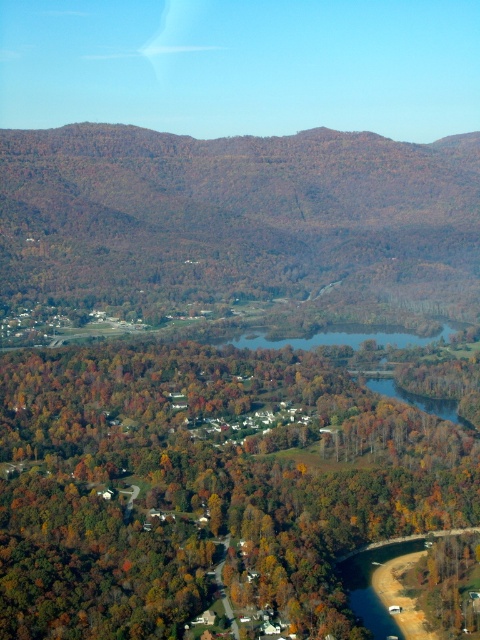
Who is shorter, green matte tree at center or blue water at center?

With less height is blue water at center.

Who is more distant from viewer, [210,532] or [335,342]?

Point [335,342]

Image resolution: width=480 pixels, height=640 pixels. What are the coordinates of `green matte tree at center` in the screenshot? It's located at click(x=204, y=484).

Is point (156, 282) positioned after point (268, 337)?

Yes, point (156, 282) is behind point (268, 337).

Between brown textured mountain at upper left and blue water at center, which one appears on the left side from the viewer's perspective?

From the viewer's perspective, brown textured mountain at upper left appears more on the left side.

This screenshot has height=640, width=480. Describe the element at coordinates (241, 220) in the screenshot. I see `brown textured mountain at upper left` at that location.

The height and width of the screenshot is (640, 480). In order to click on brown textured mountain at upper left in this screenshot , I will do `click(241, 220)`.

Can you confirm if green matte tree at center is positioned below brown textured mountain at upper left?

Yes.

Which is in front, point (381, 497) or point (88, 186)?

Positioned in front is point (381, 497).

This screenshot has height=640, width=480. What are the coordinates of `green matte tree at center` in the screenshot? It's located at point(204,484).